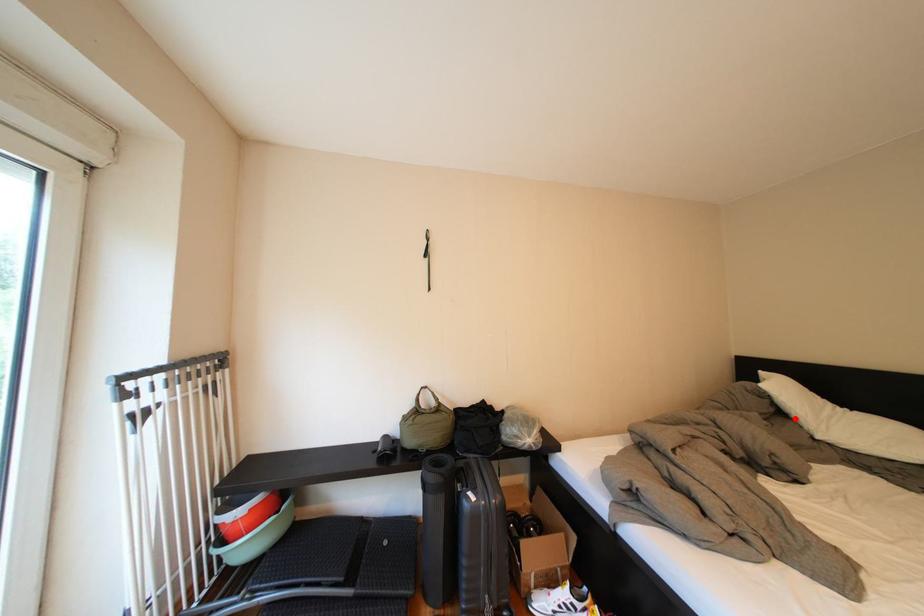
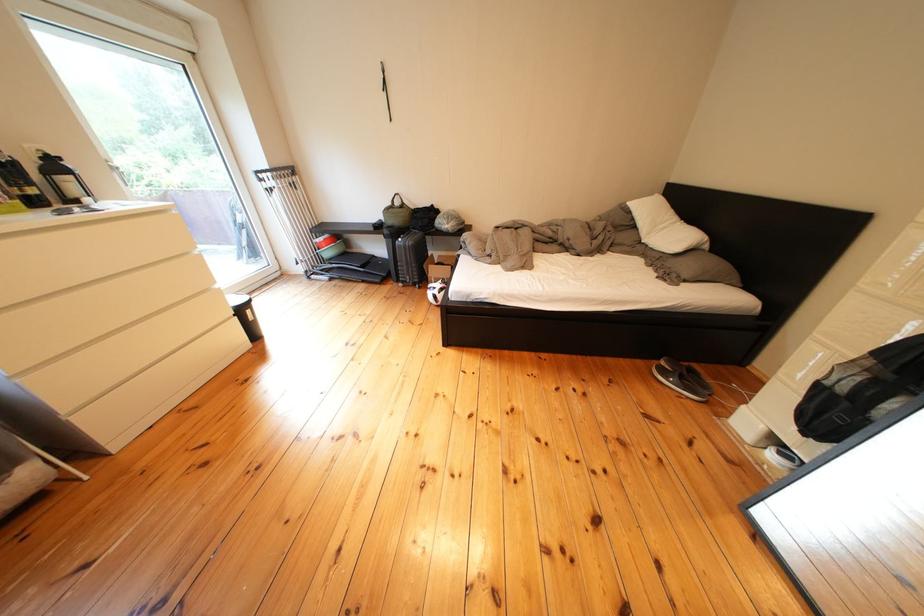
Find the pixel in the second image that matches the highlighted location in the first image.

(649, 230)